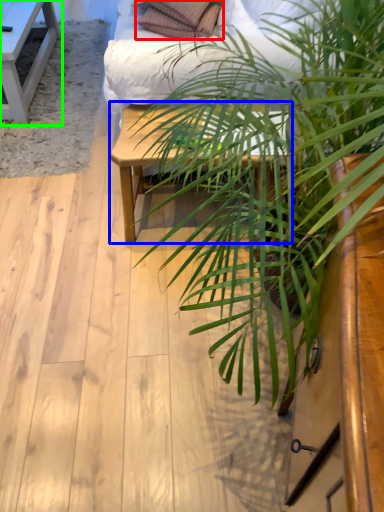
Question: Considering the real-world distances, which object is farthest from pillow (highlighted by a red box)? table (highlighted by a blue box) or table (highlighted by a green box)?

Choices:
 (A) table
 (B) table

Answer: (A)